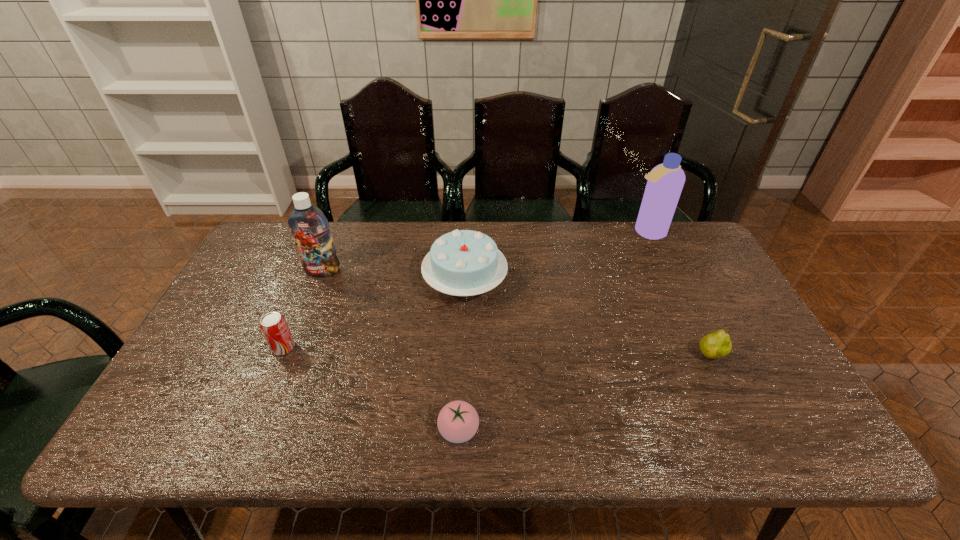
Where is `the second nearest detergent`? the second nearest detergent is located at coordinates (786, 342).

I want to click on the nearest object, so click(x=174, y=396).

Locate an element on the screen. The width and height of the screenshot is (960, 540). the leftmost red detergent is located at coordinates (174, 396).

This screenshot has height=540, width=960. Find the location of `the seventh object from left to right`. the seventh object from left to right is located at coordinates (635, 338).

Locate an element on the screen. The width and height of the screenshot is (960, 540). the shortest object is located at coordinates coord(635,338).

The height and width of the screenshot is (540, 960). I want to click on free space located 0.200m on the front surface of the tallest object, so click(x=502, y=220).

At what (x,y) coordinates should I click in order to perform the action: click on free space located on the back of the biggest white detergent. Please return your answer as a coordinate pair (x, y). This screenshot has width=960, height=540. Looking at the image, I should click on (676, 218).

The width and height of the screenshot is (960, 540). I want to click on vacant space located 0.340m on the front surface of the third detergent from right to left, so click(x=426, y=226).

I want to click on vacant space situated on the front surface of the third detergent from right to left, so click(492, 226).

Locate an element on the screen. vacant space located 0.380m on the front surface of the third detergent from right to left is located at coordinates (414, 226).